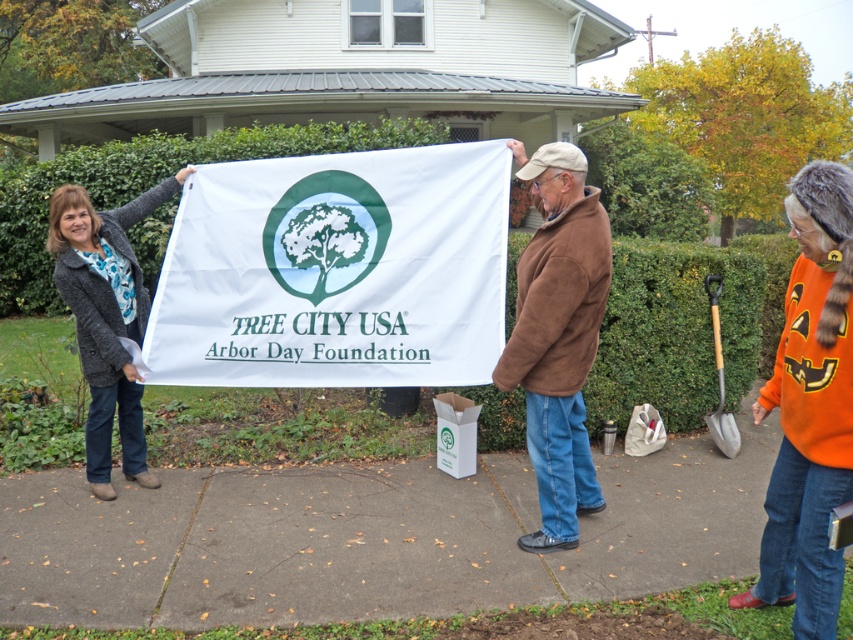
Is brown fleece jacket at center taller than dark gray textured jacket at left?

Correct, brown fleece jacket at center is much taller as dark gray textured jacket at left.

Is brown fleece jacket at center below dark gray textured jacket at left?

Correct, brown fleece jacket at center is located below dark gray textured jacket at left.

At what (x,y) coordinates should I click in order to perform the action: click on brown fleece jacket at center. Please return your answer as a coordinate pair (x, y). Looking at the image, I should click on (558, 336).

Which is above, white fabric banner at center or brown fleece jacket at center?

white fabric banner at center is higher up.

Can you confirm if white fabric banner at center is positioned above brown fleece jacket at center?

Yes, white fabric banner at center is above brown fleece jacket at center.

Is point (381, 161) farther from viewer compared to point (566, 541)?

Yes, it is.

I want to click on white fabric banner at center, so click(x=335, y=269).

Is white fabric banner at center in front of dark gray textured jacket at left?

Yes.

Does white fabric banner at center have a lesser height compared to dark gray textured jacket at left?

Correct, white fabric banner at center is not as tall as dark gray textured jacket at left.

This screenshot has width=853, height=640. Describe the element at coordinates (335, 269) in the screenshot. I see `white fabric banner at center` at that location.

Identify the location of white fabric banner at center. (335, 269).